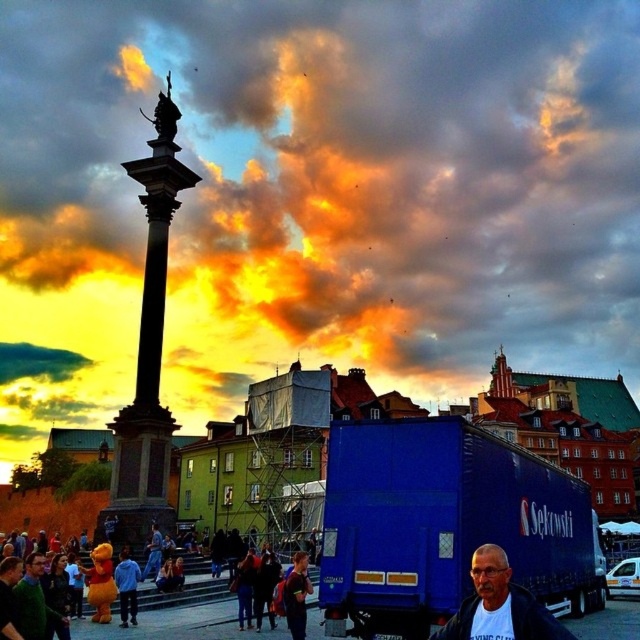
In the scene shown: You are a photographer positioned at the monument base. You want to take a photo of the blue metallic truck at center and the yellow plush bear at lower left in the same frame. Which object should you pan your camera towards first to include both?

You should pan your camera towards the yellow plush bear at lower left first because the blue metallic truck at center is to the right of it, so starting with the leftmost object allows capturing both in the frame.

You are a delivery robot with a 1.5 meter reach. You need to pick up the yellow plush bear at lower left from your current position next to the dark blue jeans at center. Can you reach it?

The distance between the yellow plush bear at lower left and the dark blue jeans at center is 6.21 meters. Since your reach is only 1.5 meters, you cannot reach the yellow plush bear at lower left from your current position.